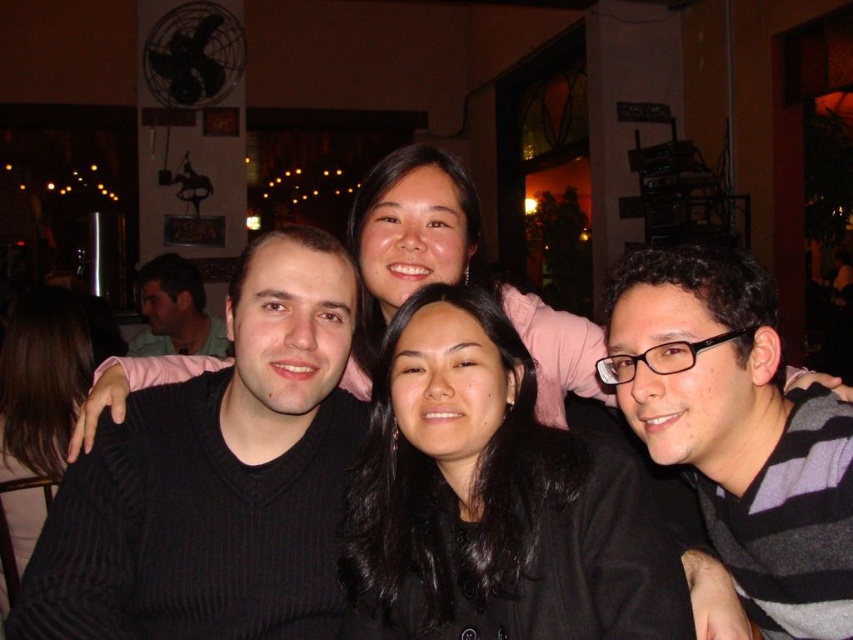
Question: Does black ribbed sweater at left appear over matte white shirt at upper left?

Choices:
 (A) no
 (B) yes

Answer: (A)

Question: Which object appears farthest from the camera in this image?

Choices:
 (A) matte white shirt at upper left
 (B) black matte hair at center

Answer: (A)

Question: Which point appears closest to the camera in this image?

Choices:
 (A) (30, 602)
 (B) (142, 280)
 (C) (677, 360)

Answer: (C)

Question: Can you confirm if black matte hair at center is smaller than striped sweater at center?

Choices:
 (A) yes
 (B) no

Answer: (A)

Question: Estimate the real-world distances between objects in this image. Which object is farther from the matte white shirt at upper left?

Choices:
 (A) black ribbed sweater at left
 (B) striped sweater at center

Answer: (B)

Question: In this image, where is black matte hair at center located relative to matte white shirt at upper left?

Choices:
 (A) left
 (B) right

Answer: (B)